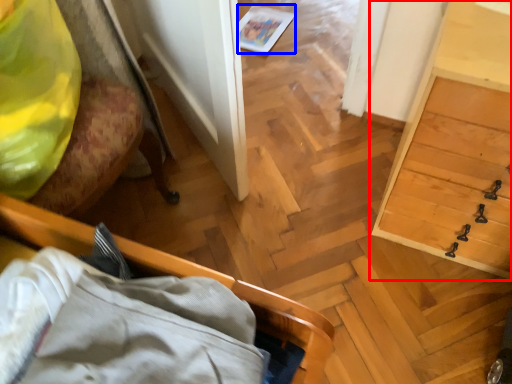
Question: Which of the following is the closest to the observer, dresser (highlighted by a red box) or magazine (highlighted by a blue box)?

Choices:
 (A) dresser
 (B) magazine

Answer: (A)